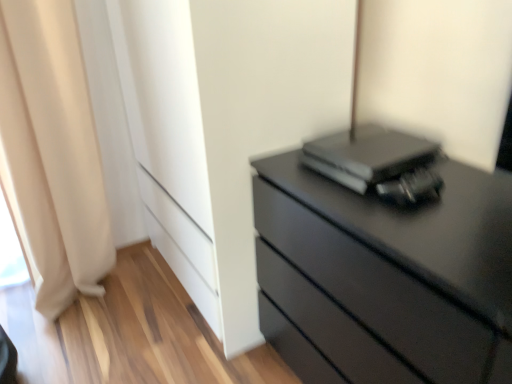
What do you see at coordinates (367, 157) in the screenshot?
I see `black matte computer at upper right` at bounding box center [367, 157].

In order to face matte black chest of drawers at right, should I rotate leftwards or rightwards?

You should rotate right by 19.124 degrees.

Where is `black matte computer at upper right`? black matte computer at upper right is located at coordinates (367, 157).

Is matte black chest of drawers at right positioned far away from black matte computer at upper right?

Actually, matte black chest of drawers at right and black matte computer at upper right are a little close together.

Is matte black chest of drawers at right behind black matte computer at upper right?

No, matte black chest of drawers at right is closer to the viewer.

Can you confirm if matte black chest of drawers at right is thinner than black matte computer at upper right?

No.

Is beige fabric curtain at left smaller than black matte computer at upper right?

No, beige fabric curtain at left is not smaller than black matte computer at upper right.

Which is correct: beige fabric curtain at left is inside black matte computer at upper right, or outside of it?

beige fabric curtain at left exists outside the volume of black matte computer at upper right.

The width and height of the screenshot is (512, 384). In order to click on computer above the beige fabric curtain at left (from a real-world perspective) in this screenshot , I will do `click(367, 157)`.

Considering the positions of point (66, 229) and point (394, 158), is point (66, 229) closer or farther from the camera than point (394, 158)?

Clearly, point (66, 229) is more distant from the camera than point (394, 158).

From a real-world perspective, which is physically above, matte black chest of drawers at right or beige fabric curtain at left?

In real-world perspective, beige fabric curtain at left is above.

Does point (482, 256) lie behind point (37, 166)?

No, it is in front of (37, 166).

Is matte black chest of drawers at right not close to beige fabric curtain at left?

Yes, matte black chest of drawers at right and beige fabric curtain at left are located far from each other.

In the scene shown: Does matte black chest of drawers at right have a greater width compared to beige fabric curtain at left?

Correct, the width of matte black chest of drawers at right exceeds that of beige fabric curtain at left.

Considering the relative sizes of beige fabric curtain at left and matte black chest of drawers at right in the image provided, is beige fabric curtain at left shorter than matte black chest of drawers at right?

Incorrect, the height of beige fabric curtain at left does not fall short of that of matte black chest of drawers at right.

What's the angular difference between beige fabric curtain at left and matte black chest of drawers at right's facing directions?

There is a 90-degree angle between the facing directions of beige fabric curtain at left and matte black chest of drawers at right.

Can matte black chest of drawers at right be found inside beige fabric curtain at left?

That's incorrect, matte black chest of drawers at right is not inside beige fabric curtain at left.

Could you tell me if beige fabric curtain at left is turned towards matte black chest of drawers at right?

No, beige fabric curtain at left does not turn towards matte black chest of drawers at right.

Between black matte computer at upper right and beige fabric curtain at left, which one has less height?

With less height is black matte computer at upper right.

In the image, is black matte computer at upper right on the left side or the right side of beige fabric curtain at left?

Based on their positions, black matte computer at upper right is located to the right of beige fabric curtain at left.

Which object is closer to the camera taking this photo, black matte computer at upper right or beige fabric curtain at left?

black matte computer at upper right.

Considering the positions of point (425, 186) and point (64, 194), is point (425, 186) closer or farther from the camera than point (64, 194)?

Point (425, 186).

From a real-world perspective, relative to matte black chest of drawers at right, is black matte computer at upper right vertically above or below?

black matte computer at upper right is above matte black chest of drawers at right.

Does black matte computer at upper right have a greater height compared to matte black chest of drawers at right?

Incorrect, the height of black matte computer at upper right is not larger of that of matte black chest of drawers at right.

Does black matte computer at upper right turn towards matte black chest of drawers at right?

No, black matte computer at upper right is not aimed at matte black chest of drawers at right.

Image resolution: width=512 pixels, height=384 pixels. Identify the location of the chest of drawers that is under the black matte computer at upper right (from a real-world perspective). (425, 229).

Image resolution: width=512 pixels, height=384 pixels. Find the location of `curtain that appears above the black matte computer at upper right (from the image's perspective)`. curtain that appears above the black matte computer at upper right (from the image's perspective) is located at coordinates (53, 151).

When comparing their distances from matte black chest of drawers at right, does beige fabric curtain at left or black matte computer at upper right seem closer?

black matte computer at upper right is positioned closer to the anchor matte black chest of drawers at right.

When comparing their distances from beige fabric curtain at left, does matte black chest of drawers at right or black matte computer at upper right seem closer?

black matte computer at upper right.

Estimate the real-world distances between objects in this image. Which object is further from beige fabric curtain at left, black matte computer at upper right or matte black chest of drawers at right?

matte black chest of drawers at right lies further to beige fabric curtain at left than the other object.

Based on their spatial positions, is black matte computer at upper right or beige fabric curtain at left further from matte black chest of drawers at right?

beige fabric curtain at left is positioned further to the anchor matte black chest of drawers at right.

When comparing their distances from black matte computer at upper right, does matte black chest of drawers at right or beige fabric curtain at left seem further?

beige fabric curtain at left is positioned further to the anchor black matte computer at upper right.

Considering their positions, is beige fabric curtain at left positioned further to black matte computer at upper right than matte black chest of drawers at right?

beige fabric curtain at left lies further to black matte computer at upper right than the other object.

I want to click on computer located between beige fabric curtain at left and matte black chest of drawers at right in the left-right direction, so (x=367, y=157).